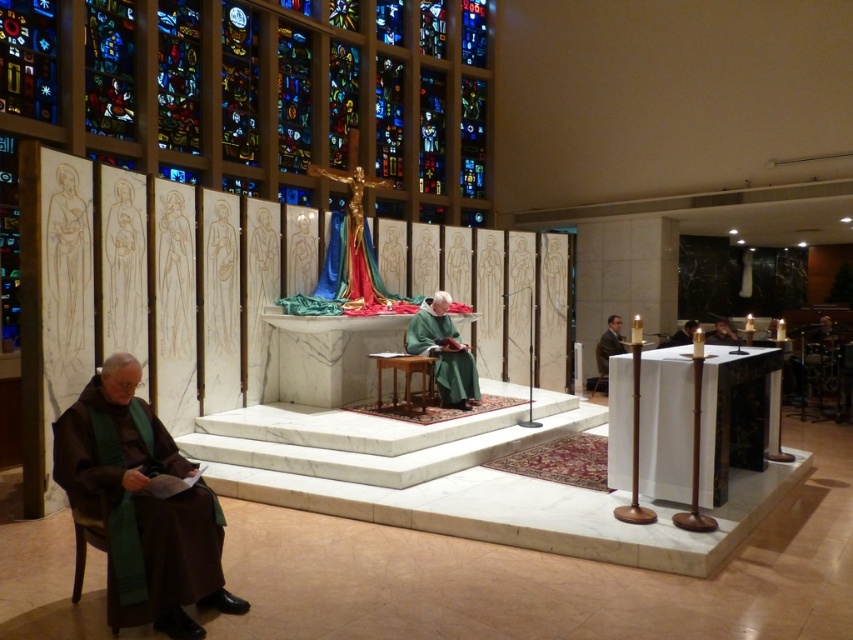
Question: Which object appears closest to the camera in this image?

Choices:
 (A) brown leather jacket at right
 (B) matte black face at right
 (C) brown woolen robe at lower left
 (D) green velvet robe at center

Answer: (C)

Question: Which object appears farthest from the camera in this image?

Choices:
 (A) green velvet robe at center
 (B) brown woolen robe at lower left
 (C) brown leather jacket at right

Answer: (C)

Question: Does brown woolen robe at lower left come in front of matte black face at right?

Choices:
 (A) yes
 (B) no

Answer: (A)

Question: Does brown woolen robe at lower left appear on the right side of green velvet robe at center?

Choices:
 (A) no
 (B) yes

Answer: (A)

Question: Can you confirm if brown leather jacket at right is bigger than matte black face at right?

Choices:
 (A) yes
 (B) no

Answer: (A)

Question: Which object is farther from the camera taking this photo?

Choices:
 (A) brown woolen robe at lower left
 (B) green velvet robe at center
 (C) matte black face at right
 (D) brown leather jacket at right

Answer: (D)